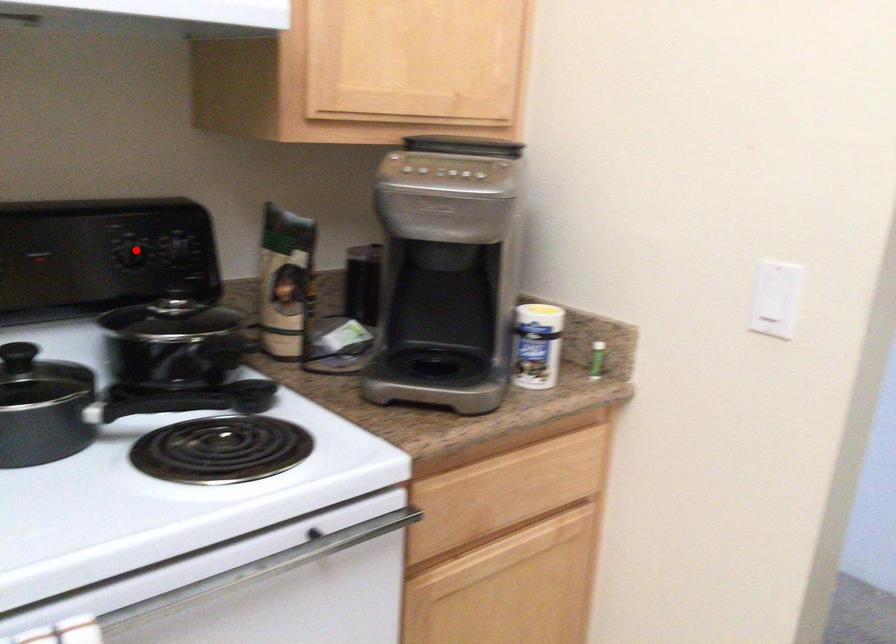
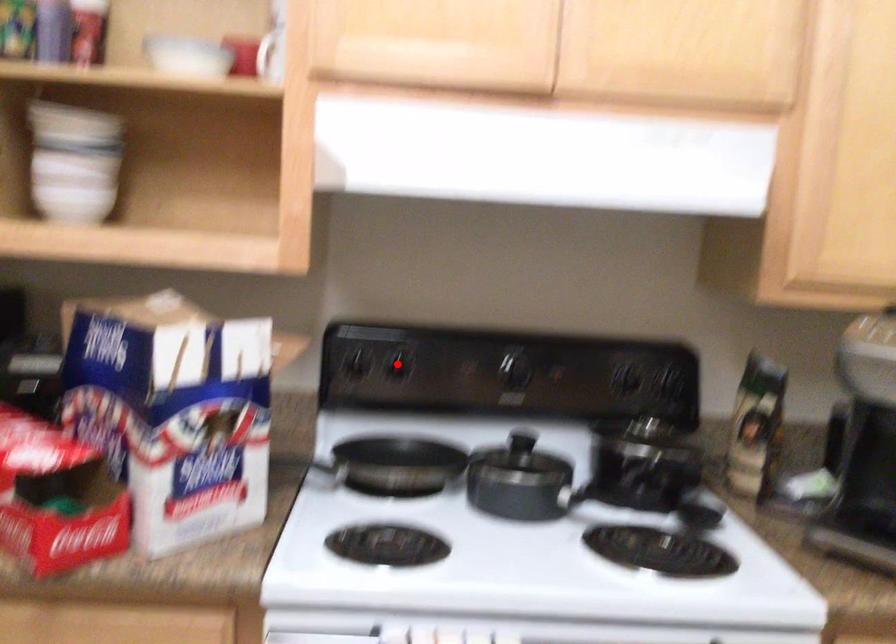
I am providing you with two images of the same scene from different viewpoints. A red point is marked on the first image and another point is marked on the second image. Does the point marked in image1 correspond to the same location as the one in image2?

No